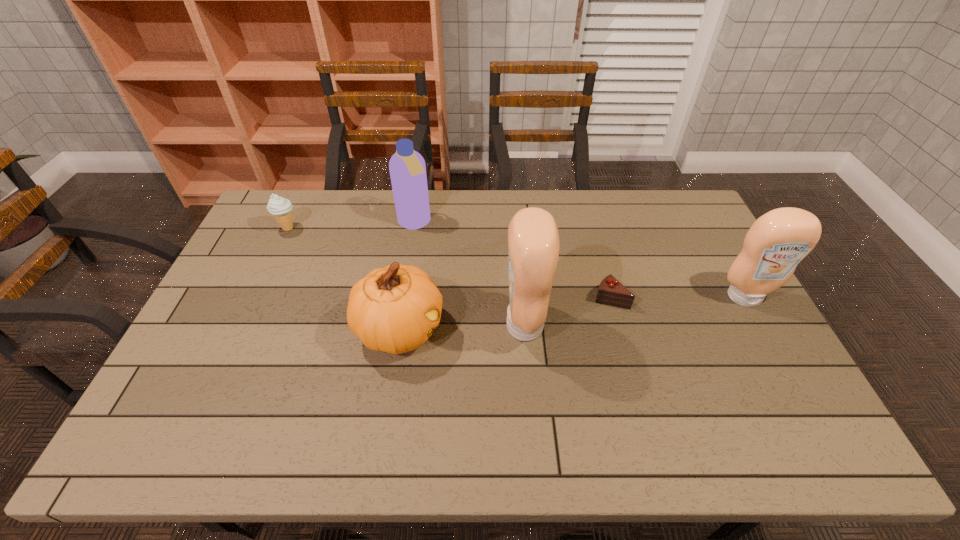
The image size is (960, 540). In order to click on free space located 0.350m on the label of the taller condiment in this screenshot , I will do `click(380, 325)`.

Where is `free region located on the label of the taller condiment`? The image size is (960, 540). free region located on the label of the taller condiment is located at coordinates (419, 325).

Identify the location of vacant region located on the label of the taller condiment. The height and width of the screenshot is (540, 960). tap(416, 325).

The width and height of the screenshot is (960, 540). What are the coordinates of `free space located on the label of the right condiment` in the screenshot? It's located at (759, 323).

I want to click on free space located 0.090m on the back of the shampoo, so click(x=419, y=196).

This screenshot has width=960, height=540. I want to click on vacant space situated on the front face of the fourth tallest object, so click(x=463, y=329).

Where is `vacant position located on the front of the leftmost object`? vacant position located on the front of the leftmost object is located at coordinates (260, 287).

Locate an element on the screen. Image resolution: width=960 pixels, height=540 pixels. vacant region located on the front of the chocolate cake is located at coordinates (625, 349).

The width and height of the screenshot is (960, 540). What are the coordinates of `shampoo that is at the far edge` in the screenshot? It's located at (407, 168).

Locate an element on the screen. The height and width of the screenshot is (540, 960). icecream positioned at the far edge is located at coordinates (280, 207).